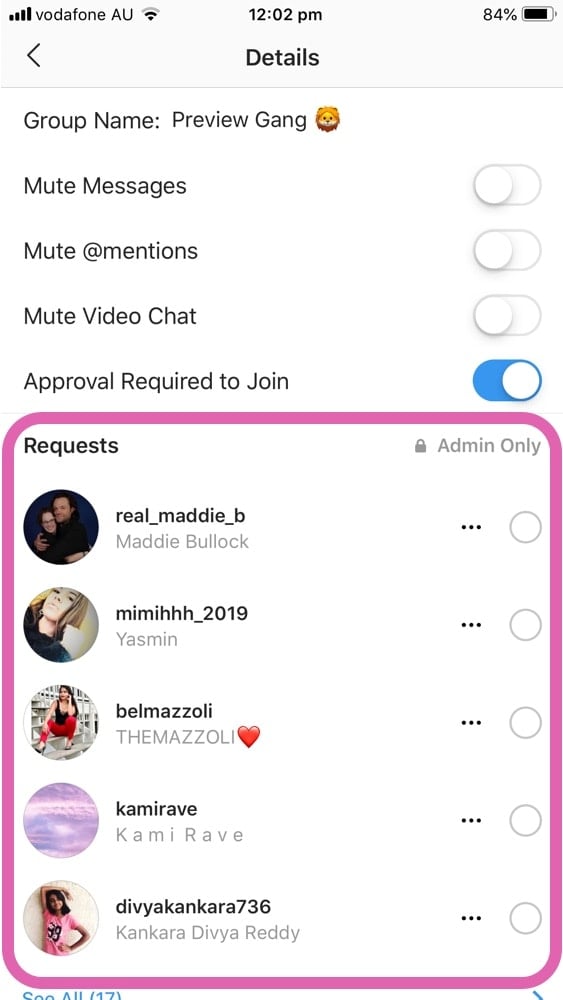
Where is `blank space next to on switch button`? Image resolution: width=563 pixels, height=1000 pixels. blank space next to on switch button is located at coordinates (450, 379).